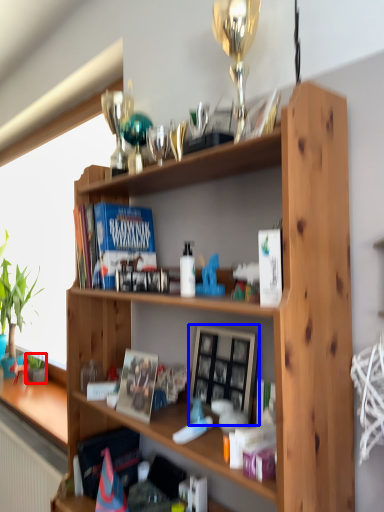
Question: Which of the following is the closest to the observer, houseplant (highlighted by a red box) or picture frame (highlighted by a blue box)?

Choices:
 (A) houseplant
 (B) picture frame

Answer: (B)